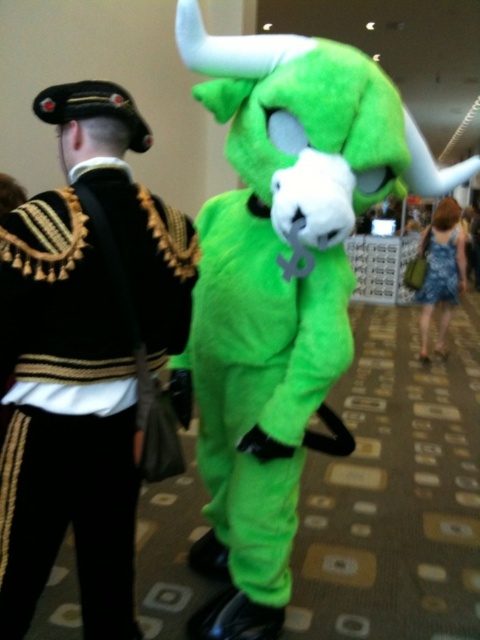
Question: Which point is closer to the camera taking this photo?

Choices:
 (A) (441, 275)
 (B) (112, 422)
 (C) (442, 273)

Answer: (B)

Question: Which of the following is the farthest from the observer?

Choices:
 (A) (259, 451)
 (B) (429, 276)
 (C) (460, 282)

Answer: (B)

Question: Which of the following is the farthest from the observer?

Choices:
 (A) (283, 412)
 (B) (423, 236)

Answer: (B)

Question: Where is green fuzzy costume at center located in relation to blue denim dress at lower right in the image?

Choices:
 (A) below
 (B) above

Answer: (A)

Question: Is green fuzzy costume at center smaller than blue denim dress at lower right?

Choices:
 (A) no
 (B) yes

Answer: (A)

Question: Is black velvet jacket at upper left positioned behind blue denim dress at lower right?

Choices:
 (A) yes
 (B) no

Answer: (B)